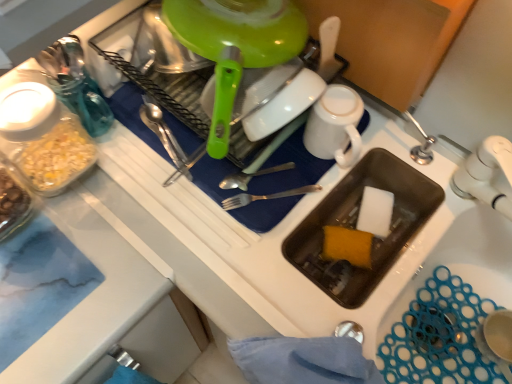
Question: From the image's perspective, would you say silver metallic fork at center is positioned over shiny metal spoon at center?

Choices:
 (A) no
 (B) yes

Answer: (A)

Question: From a real-world perspective, is silver metallic fork at center beneath shiny metal spoon at center?

Choices:
 (A) yes
 (B) no

Answer: (A)

Question: Is shiny metal spoon at center at the back of silver metallic fork at center?

Choices:
 (A) yes
 (B) no

Answer: (B)

Question: Considering the relative positions of silver metallic fork at center and shiny metal spoon at center in the image provided, is silver metallic fork at center in front of shiny metal spoon at center?

Choices:
 (A) no
 (B) yes

Answer: (B)

Question: From a real-world perspective, is silver metallic fork at center on shiny metal spoon at center?

Choices:
 (A) no
 (B) yes

Answer: (A)

Question: Does point (373, 192) appear closer or farther from the camera than point (274, 198)?

Choices:
 (A) closer
 (B) farther

Answer: (B)

Question: In terms of width, does white sponge at sink bottom, arranged as the first food when viewed from the right, look wider or thinner when compared to silver metallic fork at center?

Choices:
 (A) wide
 (B) thin

Answer: (B)

Question: From the image's perspective, is white sponge at sink bottom, the 2th food viewed from the left, positioned above or below silver metallic fork at center?

Choices:
 (A) above
 (B) below

Answer: (B)

Question: Relative to silver metallic fork at center, is white sponge at sink bottom, arranged as the first food when viewed from the right, in front or behind?

Choices:
 (A) front
 (B) behind

Answer: (B)

Question: From the image's perspective, is white matte mug at upper center above or below white sponge at sink bottom, arranged as the first food when viewed from the right?

Choices:
 (A) above
 (B) below

Answer: (A)

Question: In terms of height, does white matte mug at upper center look taller or shorter compared to white sponge at sink bottom, the 2th food viewed from the left?

Choices:
 (A) tall
 (B) short

Answer: (A)

Question: Is white matte mug at upper center inside the boundaries of white sponge at sink bottom, arranged as the first food when viewed from the right, or outside?

Choices:
 (A) outside
 (B) inside

Answer: (A)

Question: Would you say white matte mug at upper center is to the left or to the right of white sponge at sink bottom, the 2th food viewed from the left, in the picture?

Choices:
 (A) left
 (B) right

Answer: (A)

Question: In terms of height, does shiny metal spoon at center look taller or shorter compared to white sponge at sink bottom, the 2th food viewed from the left?

Choices:
 (A) short
 (B) tall

Answer: (A)

Question: Relative to white sponge at sink bottom, arranged as the first food when viewed from the right, is shiny metal spoon at center in front or behind?

Choices:
 (A) front
 (B) behind

Answer: (A)